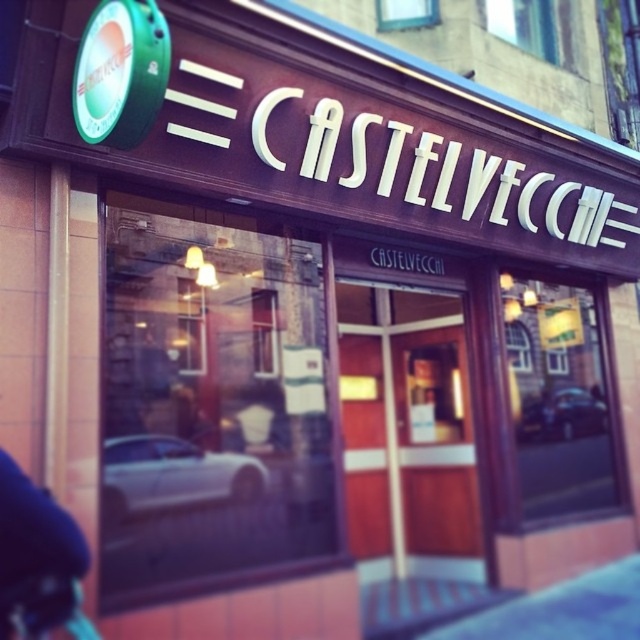
Can you confirm if white glossy car at lower left is positioned to the left of shiny silver car at center?

Indeed, white glossy car at lower left is positioned on the left side of shiny silver car at center.

What do you see at coordinates (172, 474) in the screenshot? I see `white glossy car at lower left` at bounding box center [172, 474].

Between point (124, 444) and point (529, 403), which one is positioned in front?

Point (124, 444) is in front.

Where is `white glossy car at lower left`? The image size is (640, 640). white glossy car at lower left is located at coordinates (172, 474).